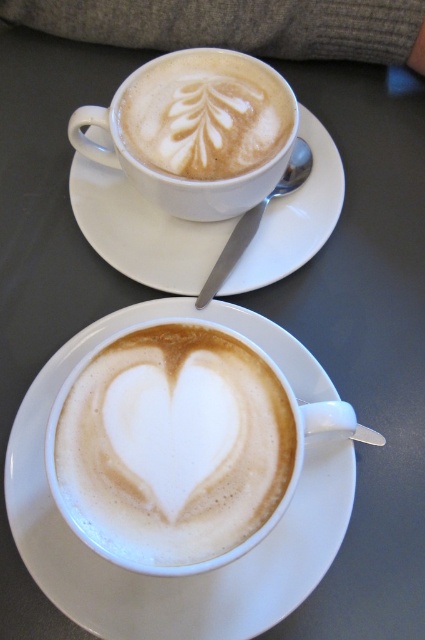
Question: Can you confirm if white ceramic saucer at center is wider than white ceramic saucer at upper center?

Choices:
 (A) no
 (B) yes

Answer: (A)

Question: Observing the image, what is the correct spatial positioning of white ceramic saucer at center in reference to latte art at upper center?

Choices:
 (A) below
 (B) above

Answer: (A)

Question: Which point appears closest to the camera in this image?

Choices:
 (A) (99, 180)
 (B) (138, 573)

Answer: (B)

Question: Among these points, which one is farthest from the camera?

Choices:
 (A) (166, 636)
 (B) (204, 83)

Answer: (B)

Question: Estimate the real-world distances between objects in this image. Which object is closer to the white ceramic saucer at upper center?

Choices:
 (A) latte art at upper center
 (B) white ceramic saucer at center

Answer: (A)

Question: Is white ceramic saucer at upper center to the left of latte art at upper center from the viewer's perspective?

Choices:
 (A) no
 (B) yes

Answer: (A)